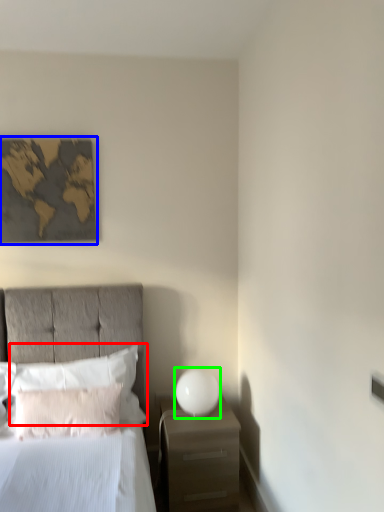
Question: Estimate the real-world distances between objects in this image. Which object is farther from pillow (highlighted by a red box), picture frame (highlighted by a blue box) or bedside lamp (highlighted by a green box)?

Choices:
 (A) picture frame
 (B) bedside lamp

Answer: (A)